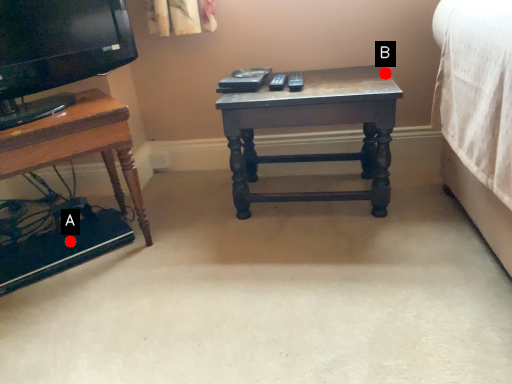
Question: Two points are circled on the image, labeled by A and B beside each circle. Which point appears closest to the camera in this image?

Choices:
 (A) A is closer
 (B) B is closer

Answer: (A)